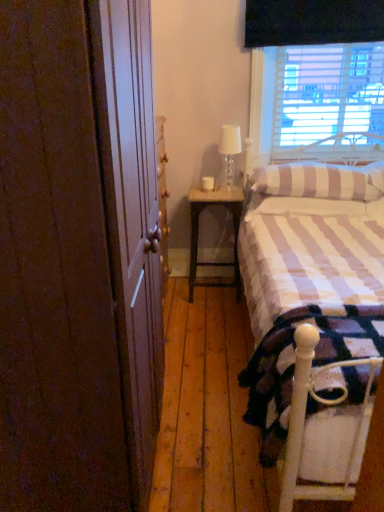
Where is `free space in front of wooden nightstand at center`? The width and height of the screenshot is (384, 512). free space in front of wooden nightstand at center is located at coordinates (212, 312).